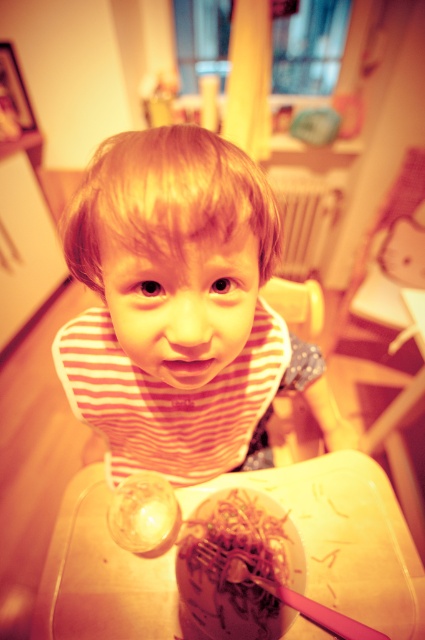
Who is taller, striped fabric bib at center or translucent plastic tray at center?

striped fabric bib at center is taller.

Who is more distant from viewer, (266,358) or (350,612)?

The point (350,612) is behind.

Does point (90, 176) lie in front of point (328, 580)?

Yes, point (90, 176) is closer to viewer.

In order to click on striped fabric bib at center in this screenshot , I will do click(x=180, y=307).

Who is more forward, (367, 493) or (340, 628)?

Point (340, 628) is in front.

At what (x,y) coordinates should I click in order to perform the action: click on translucent plastic tray at center. Please return your answer as a coordinate pair (x, y). Image resolution: width=425 pixels, height=640 pixels. Looking at the image, I should click on (343, 536).

Which is below, striped fabric bib at center or shiny brown noodles at lower center?

shiny brown noodles at lower center is below.

Who is more forward, (x=215, y=268) or (x=246, y=628)?

Point (x=215, y=268) is in front.

Between point (227, 387) and point (291, 540), which one is positioned in front?

Point (227, 387) is more forward.

Where is `striped fabric bib at center`? striped fabric bib at center is located at coordinates (180, 307).